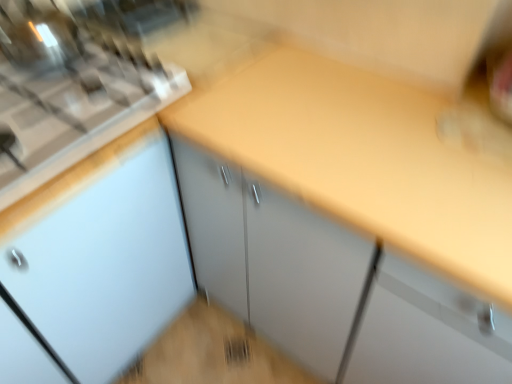
Question: Considering the positions of satin silver gas stove at upper left and yellow laminate countertop at center in the image, is satin silver gas stove at upper left taller or shorter than yellow laminate countertop at center?

Choices:
 (A) tall
 (B) short

Answer: (B)

Question: Looking at their shapes, would you say satin silver gas stove at upper left is wider or thinner than yellow laminate countertop at center?

Choices:
 (A) wide
 (B) thin

Answer: (B)

Question: Would you say satin silver gas stove at upper left is to the left or to the right of yellow laminate countertop at center in the picture?

Choices:
 (A) left
 (B) right

Answer: (A)

Question: Based on their positions, is yellow laminate countertop at center located to the left or right of satin silver gas stove at upper left?

Choices:
 (A) right
 (B) left

Answer: (A)

Question: From a real-world perspective, is yellow laminate countertop at center positioned above or below satin silver gas stove at upper left?

Choices:
 (A) below
 (B) above

Answer: (A)

Question: Is point pos(382,132) closer or farther from the camera than point pos(18,13)?

Choices:
 (A) closer
 (B) farther

Answer: (A)

Question: From the image's perspective, is yellow laminate countertop at center above or below satin silver gas stove at upper left?

Choices:
 (A) above
 (B) below

Answer: (B)